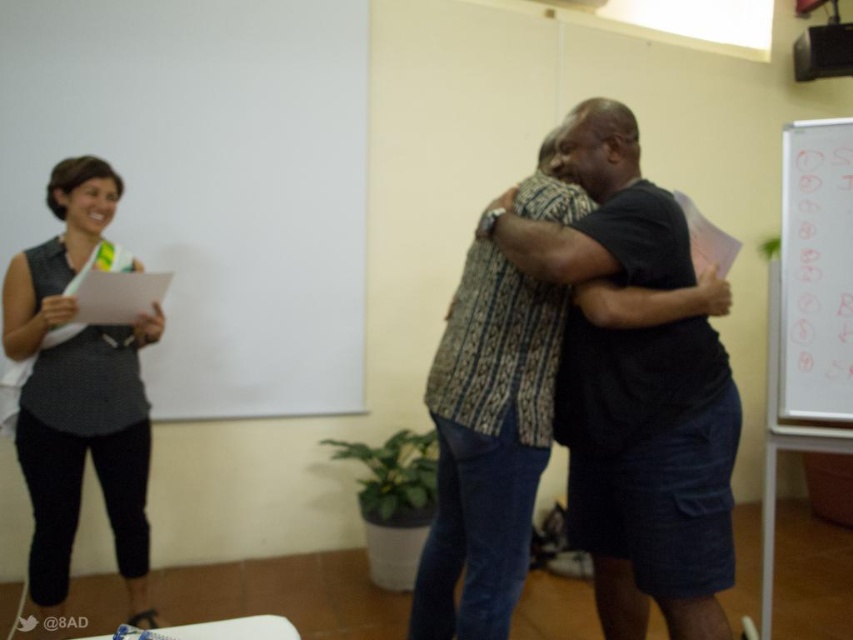
You are standing in the classroom and want to move from point A to point B. Point A is at coordinates point (540, 448) and point B is at coordinates point (836, 195). Which point is closer to you when you start at point A?

Point A at coordinates point (540, 448) is closer to you since it is your starting position.

You are a photographer trying to capture the two people in the scene. Since you want to ensure both the dark blue textured shorts at center and the patterned fabric shirt at center are clearly visible in your photo, which one should you focus on first to ensure proper focus? Explain your reasoning based on their sizes.

You should focus on the dark blue textured shorts at center first because it is larger in size compared to the patterned fabric shirt at center, making it easier to capture clearly.